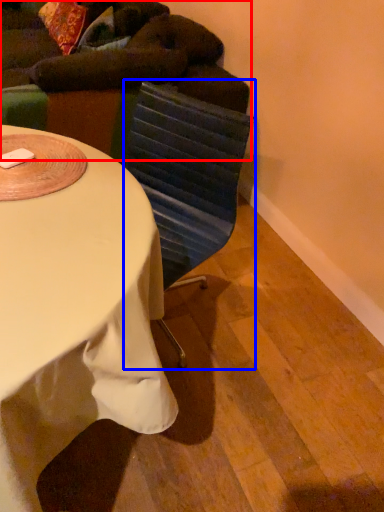
Question: Which object appears farthest to the camera in this image, bean bag chair (highlighted by a red box) or swivel chair (highlighted by a blue box)?

Choices:
 (A) bean bag chair
 (B) swivel chair

Answer: (A)